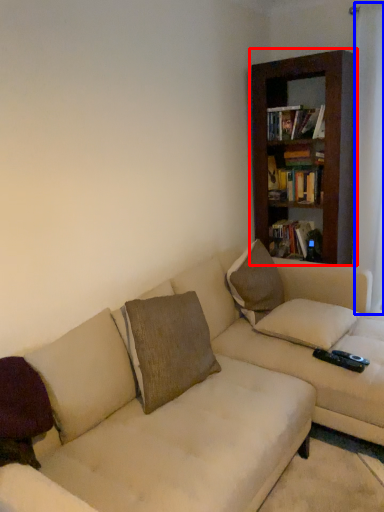
Question: Among these objects, which one is farthest to the camera, bookcase (highlighted by a red box) or curtain (highlighted by a blue box)?

Choices:
 (A) bookcase
 (B) curtain

Answer: (A)